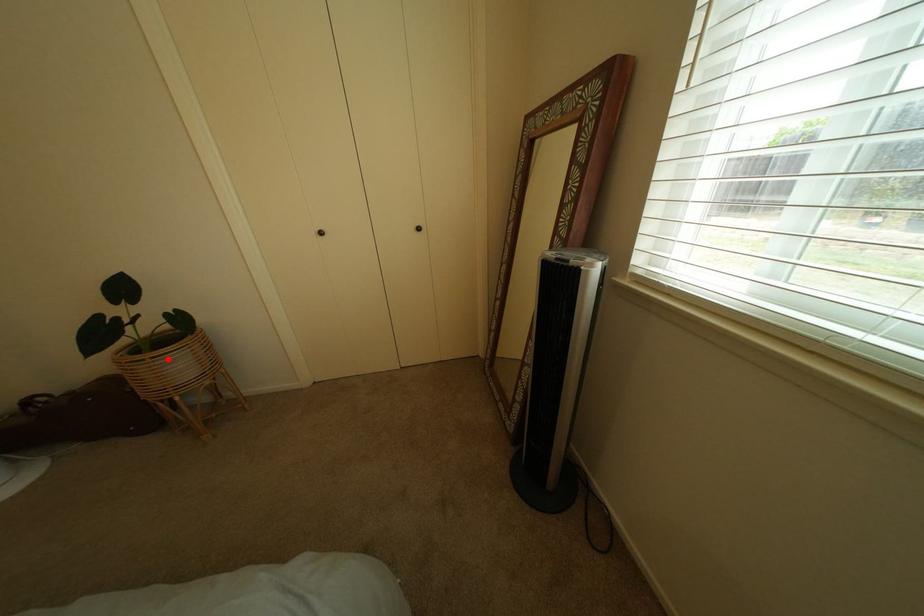
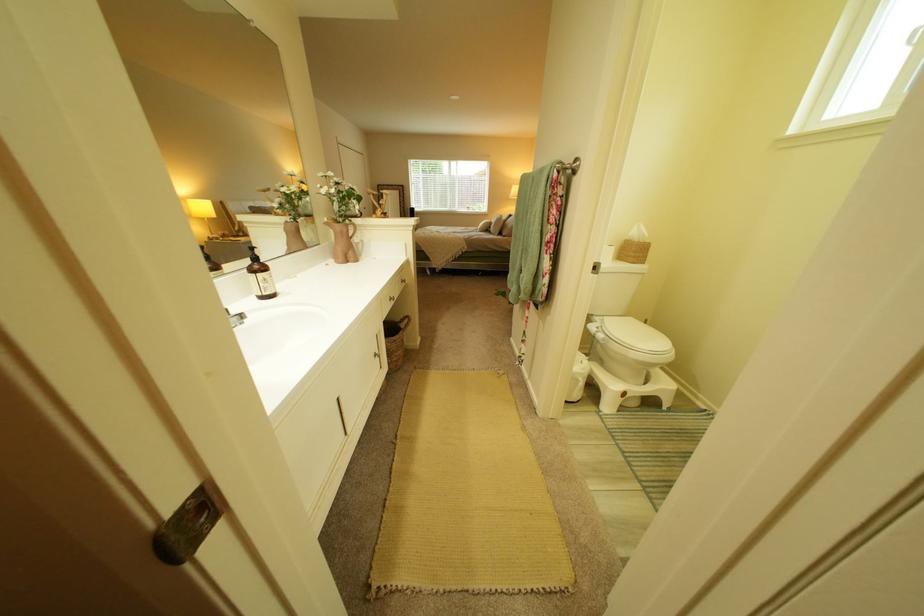
Question: I am providing you with two images of the same scene from different viewpoints. A red point is marked on the first image. Is the red point's position out of view in image 2?

Choices:
 (A) Yes
 (B) No

Answer: (A)